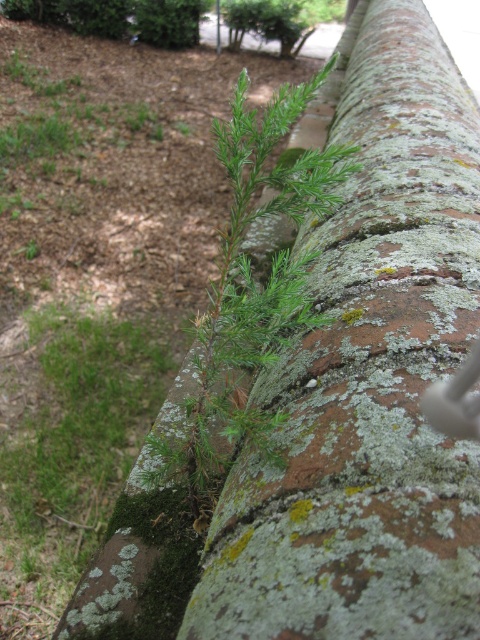
You are a gardener trying to water the green fuzzy plant at upper center. The green mossy brick wall at upper center is in your way. Can you reach the plant without moving the wall?

The green mossy brick wall at upper center is closer to the viewer than the green fuzzy plant at upper center, so the wall is blocking your direct access to the plant. You would need to move around the wall or find another path to reach the plant.

From the picture: You are a gardener looking at the green mossy brick wall at upper center and the green fuzzy plant at upper center. Which object is positioned to the right side?

The green mossy brick wall at upper center is positioned to the right of the green fuzzy plant at upper center.